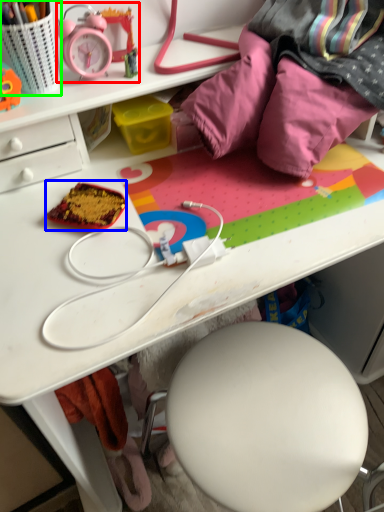
Question: Estimate the real-world distances between objects in this image. Which object is farther from stationery (highlighted by a red box), stuff (highlighted by a blue box) or stationery (highlighted by a green box)?

Choices:
 (A) stuff
 (B) stationery

Answer: (A)